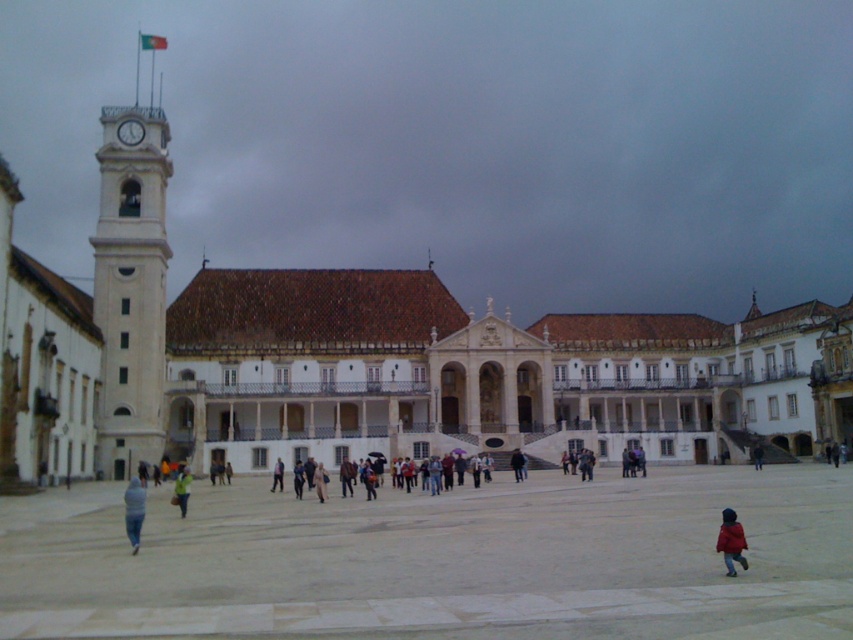
Question: Which of the following is the closest to the observer?

Choices:
 (A) (189, 496)
 (B) (126, 506)
 (C) (753, 442)

Answer: (B)

Question: Which point is closer to the camera taking this photo?

Choices:
 (A) (178, 467)
 (B) (131, 531)
 (C) (277, 627)
 (D) (115, 368)

Answer: (C)

Question: Can you confirm if smooth stone pavement at center is positioned to the right of dark blue jacket at center?

Choices:
 (A) no
 (B) yes

Answer: (A)

Question: Observing the image, what is the correct spatial positioning of white stone clock tower at left in reference to dark blue jacket at center?

Choices:
 (A) right
 (B) left

Answer: (B)

Question: Which point appears farthest from the camera in this image?

Choices:
 (A) (109, 257)
 (B) (753, 456)

Answer: (B)

Question: Is blue fuzzy jacket at lower left below light brown leather jacket at center?

Choices:
 (A) yes
 (B) no

Answer: (B)